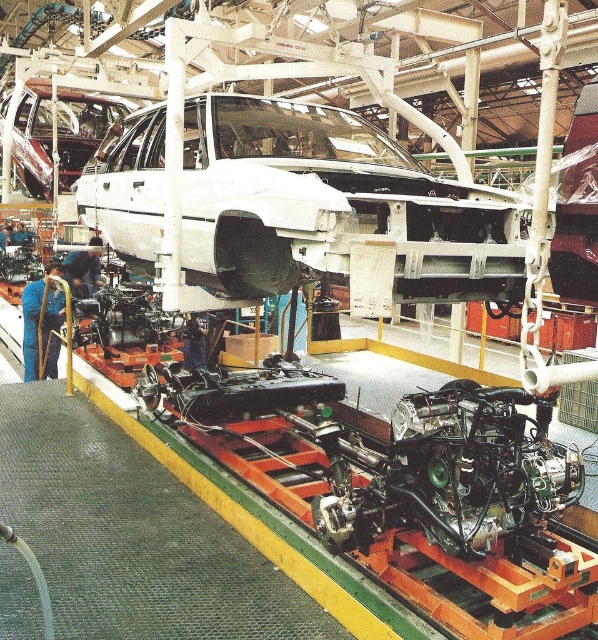
You are an engineer inspecting the assembly line. You notice a point marked at coordinates (334,209). What object is located at this point?

The white matte car at center is represented by point (334,209).

You are a quality inspector in the factory. You need to compare the sizes of the white matte car at center and the shiny chrome car at upper left. Which one is bigger?

The shiny chrome car at upper left is bigger than the white matte car at center.